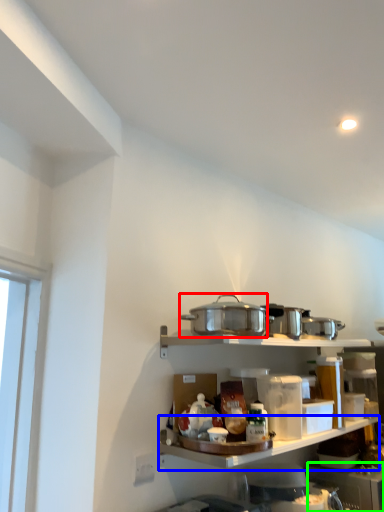
Question: Which object is positioned closest to appliance (highlighted by a red box)? Select from shelf (highlighted by a blue box) and appliance (highlighted by a green box).

Choices:
 (A) shelf
 (B) appliance

Answer: (A)